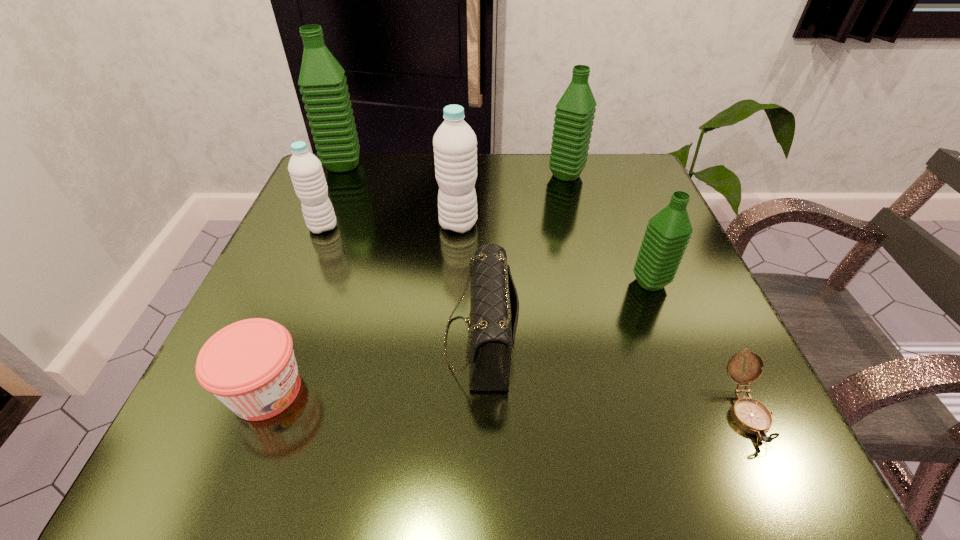
The width and height of the screenshot is (960, 540). Find the location of `vacant area situated on the front flap of the third shortest object`. vacant area situated on the front flap of the third shortest object is located at coordinates (288, 340).

The width and height of the screenshot is (960, 540). In order to click on vacant region located on the front label of the seventh tallest object in this screenshot , I will do `click(494, 391)`.

At what (x,y) coordinates should I click in order to perform the action: click on jam that is at the near edge. Please return your answer as a coordinate pair (x, y). The height and width of the screenshot is (540, 960). Looking at the image, I should click on (250, 366).

Image resolution: width=960 pixels, height=540 pixels. What are the coordinates of `compass located at the near edge` in the screenshot? It's located at (750, 415).

Locate an element on the screen. jam located at the left edge is located at coordinates (250, 366).

Find the location of a particular element. Image resolution: width=960 pixels, height=540 pixels. compass that is at the right edge is located at coordinates pos(750,415).

Find the location of a particular element. object that is at the far left corner is located at coordinates (325, 93).

At what (x,y) coordinates should I click in order to perform the action: click on object present at the near left corner. Please return your answer as a coordinate pair (x, y). Looking at the image, I should click on (250, 366).

Locate an element on the screen. This screenshot has height=540, width=960. object positioned at the far right corner is located at coordinates (575, 110).

In order to click on object located in the near right corner section of the desktop in this screenshot , I will do `click(750, 415)`.